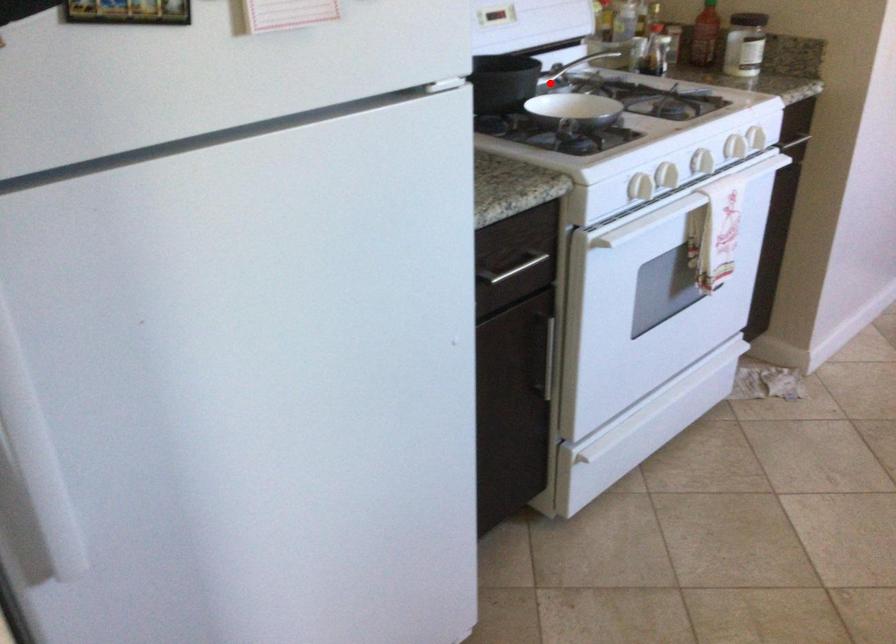
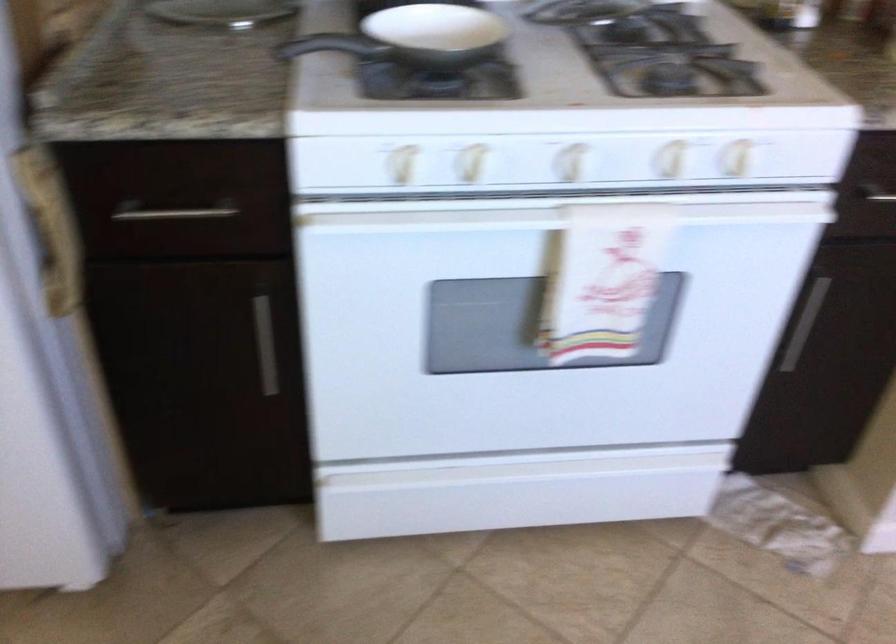
Question: I am providing you with two images of the same scene from different viewpoints. Image1 has a red point marked. In image2, the corresponding 3D location appears at what relative position? Reply with the corresponding letter.

Choices:
 (A) Closer
 (B) Farther

Answer: (A)